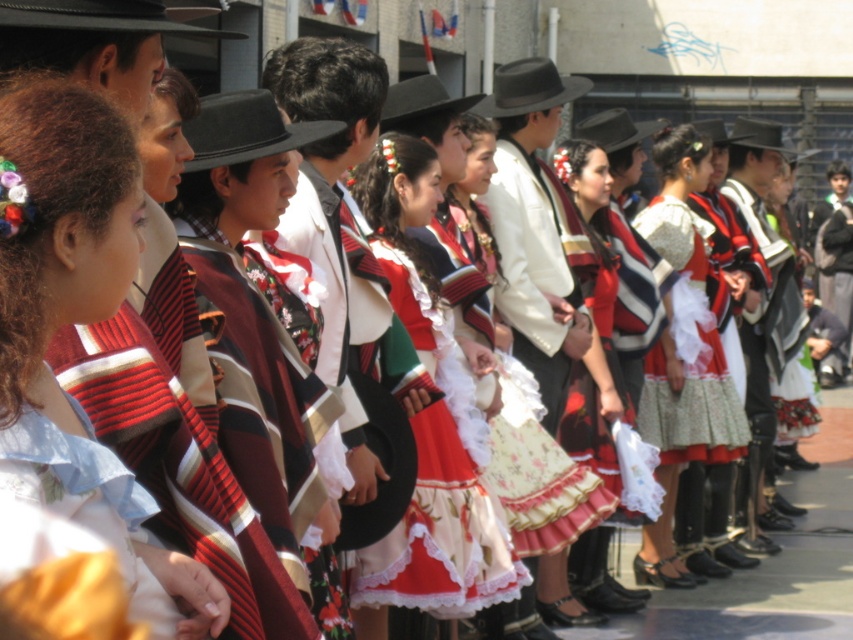
Is the position of matte striped dress at center more distant than that of floral cotton dress at center?

No, matte striped dress at center is in front of floral cotton dress at center.

Looking at this image, who is more distant from viewer, (12, 365) or (654, 385)?

Positioned behind is point (654, 385).

You are a GUI agent. You are given a task and a screenshot of the screen. Output one action in this format:
    pyautogui.click(x=<x>, y=<y>)
    Task: Click on the matte striped dress at center
    
    Given the screenshot: What is the action you would take?
    pyautogui.click(x=61, y=241)

Is point (480, 605) closer to camera compared to point (664, 561)?

Yes, point (480, 605) is closer to viewer.

Is floral lace dress at center to the right of floral cotton dress at center from the viewer's perspective?

No, floral lace dress at center is not to the right of floral cotton dress at center.

Is point (415, 516) closer to viewer compared to point (686, 416)?

Yes, point (415, 516) is closer to viewer.

This screenshot has width=853, height=640. What are the coordinates of `floral lace dress at center` in the screenshot? It's located at (430, 417).

Which of these two, matte striped dress at center or matte red skirt at center, stands taller?

With more height is matte striped dress at center.

Does point (163, 552) come farther from viewer compared to point (598, 228)?

No.

I want to click on matte striped dress at center, so click(x=61, y=241).